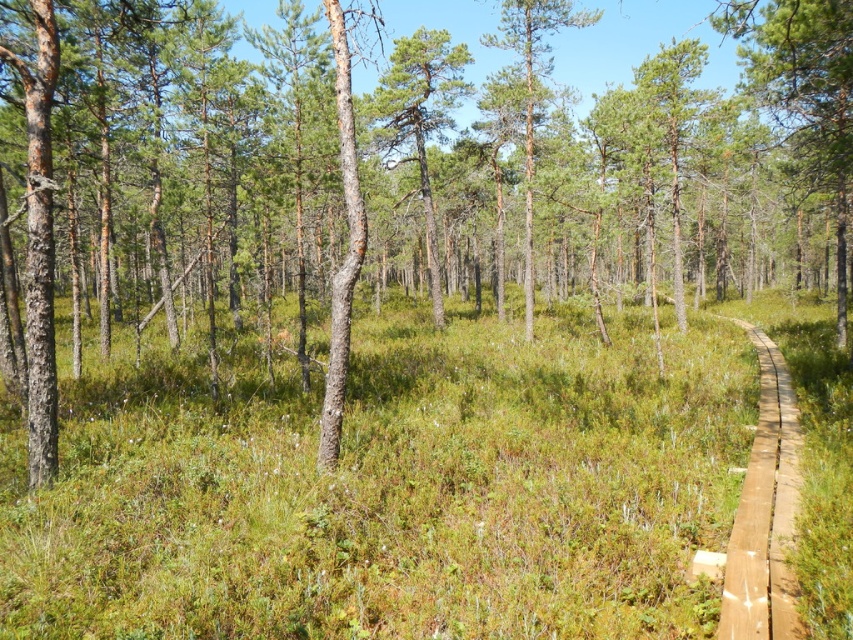
Question: Which point is farther from the camera taking this photo?

Choices:
 (A) (631, 314)
 (B) (746, 506)
 (C) (454, 100)

Answer: (C)

Question: Which is nearer to the green matte tree at center?

Choices:
 (A) brown wooden trail at right
 (B) green grassy at center

Answer: (B)

Question: Where is green grassy at center located in relation to brown wooden trail at right in the image?

Choices:
 (A) right
 (B) left

Answer: (B)

Question: Which point is farther from the camera taking this photo?

Choices:
 (A) (766, 392)
 (B) (445, 108)
 (C) (473, 392)

Answer: (B)

Question: Can you confirm if green grassy at center is positioned to the left of brown wooden trail at right?

Choices:
 (A) no
 (B) yes

Answer: (B)

Question: From the image, what is the correct spatial relationship of brown wooden trail at right in relation to green matte tree at center?

Choices:
 (A) above
 (B) below

Answer: (B)